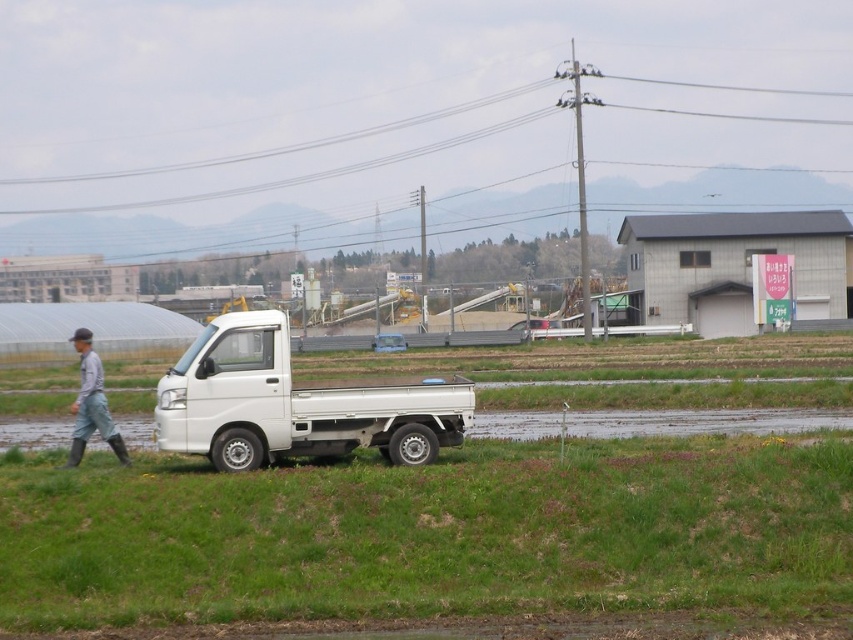
Question: Which is nearer to the gray fabric pants at left?

Choices:
 (A) white matte truck at center
 (B) green grass at lower center

Answer: (A)

Question: Is green grass at lower center closer to camera compared to white matte truck at center?

Choices:
 (A) yes
 (B) no

Answer: (A)

Question: Which object is closer to the camera taking this photo?

Choices:
 (A) green grass at lower center
 (B) white matte truck at center

Answer: (A)

Question: Which point appears closest to the camera in this image?

Choices:
 (A) (96, 387)
 (B) (242, 403)

Answer: (B)

Question: Is green grass at lower center bigger than white matte truck at center?

Choices:
 (A) yes
 (B) no

Answer: (B)

Question: Is green grass at lower center to the right of gray fabric pants at left from the viewer's perspective?

Choices:
 (A) yes
 (B) no

Answer: (A)